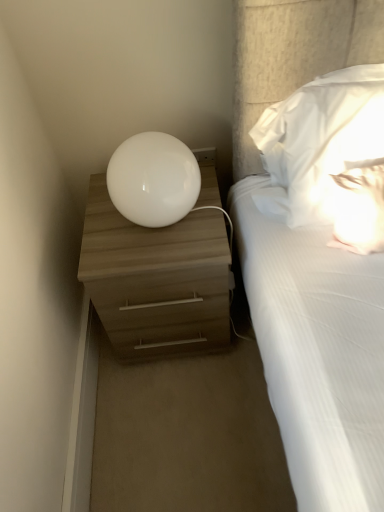
Question: Is matte wood nightstand at left far away from white soft pillow at upper right?

Choices:
 (A) yes
 (B) no

Answer: (B)

Question: Considering the relative sizes of matte wood nightstand at left and white soft pillow at upper right in the image provided, is matte wood nightstand at left bigger than white soft pillow at upper right?

Choices:
 (A) no
 (B) yes

Answer: (B)

Question: Is matte wood nightstand at left shorter than white soft pillow at upper right?

Choices:
 (A) no
 (B) yes

Answer: (A)

Question: Considering the relative positions of matte wood nightstand at left and white soft pillow at upper right in the image provided, is matte wood nightstand at left to the right of white soft pillow at upper right from the viewer's perspective?

Choices:
 (A) yes
 (B) no

Answer: (B)

Question: Is the depth of matte wood nightstand at left greater than that of white soft pillow at upper right?

Choices:
 (A) no
 (B) yes

Answer: (B)

Question: Is point (99, 312) positioned closer to the camera than point (327, 74)?

Choices:
 (A) farther
 (B) closer

Answer: (A)

Question: Considering the positions of matte wood nightstand at left and white soft pillow at upper right in the image, is matte wood nightstand at left bigger or smaller than white soft pillow at upper right?

Choices:
 (A) big
 (B) small

Answer: (A)

Question: From a real-world perspective, is matte wood nightstand at left physically located above or below white soft pillow at upper right?

Choices:
 (A) below
 (B) above

Answer: (A)

Question: Do you think matte wood nightstand at left is within white soft pillow at upper right, or outside of it?

Choices:
 (A) outside
 (B) inside

Answer: (A)

Question: Is white soft pillow at upper right bigger or smaller than matte wood nightstand at left?

Choices:
 (A) big
 (B) small

Answer: (B)

Question: Considering the relative positions of white soft pillow at upper right and matte wood nightstand at left in the image provided, is white soft pillow at upper right to the left or to the right of matte wood nightstand at left?

Choices:
 (A) left
 (B) right

Answer: (B)

Question: Does point (317, 92) appear closer or farther from the camera than point (221, 320)?

Choices:
 (A) closer
 (B) farther

Answer: (A)

Question: Considering their positions, is white soft pillow at upper right located in front of or behind matte wood nightstand at left?

Choices:
 (A) behind
 (B) front

Answer: (B)

Question: Is point (203, 300) closer or farther from the camera than point (134, 153)?

Choices:
 (A) farther
 (B) closer

Answer: (A)

Question: Is matte wood nightstand at left taller or shorter than white glossy sphere at upper center?

Choices:
 (A) short
 (B) tall

Answer: (B)